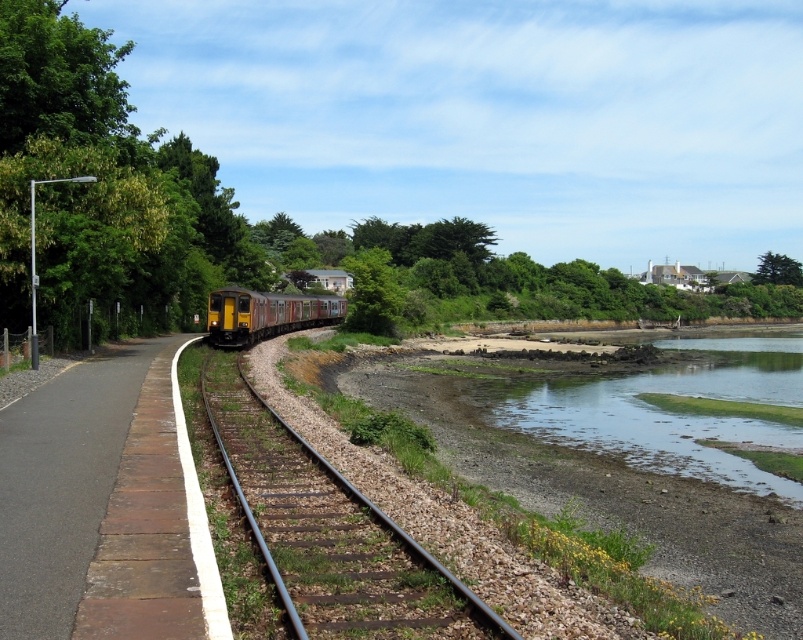
Question: Is the position of green leafy tree at center less distant than that of green leafy tree at upper right?

Choices:
 (A) no
 (B) yes

Answer: (B)

Question: Which point is farther from the camera taking this photo?

Choices:
 (A) (785, 282)
 (B) (365, 572)

Answer: (A)

Question: Can you confirm if metallic brown train track at center is positioned to the right of green leafy tree at center?

Choices:
 (A) yes
 (B) no

Answer: (A)

Question: Considering the relative positions of metallic brown train track at center and yellow metallic train at center in the image provided, where is metallic brown train track at center located with respect to yellow metallic train at center?

Choices:
 (A) right
 (B) left

Answer: (A)

Question: Estimate the real-world distances between objects in this image. Which object is closer to the green leafy tree at center?

Choices:
 (A) metallic brown train track at center
 (B) yellow metallic train at center
 (C) green leafy tree at upper right

Answer: (B)

Question: Among these objects, which one is farthest from the camera?

Choices:
 (A) green leafy tree at upper right
 (B) yellow metallic train at center

Answer: (A)